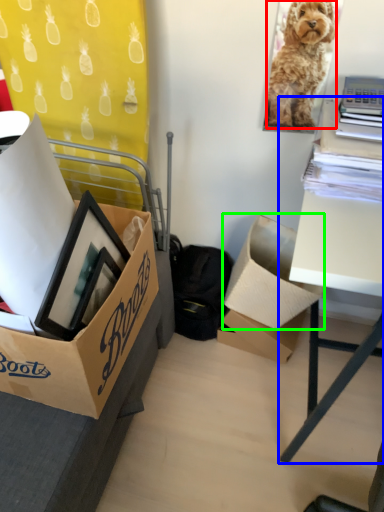
Question: Considering the real-world distances, which object is farthest from dog (highlighted by a red box)? table (highlighted by a blue box) or box (highlighted by a green box)?

Choices:
 (A) table
 (B) box

Answer: (B)